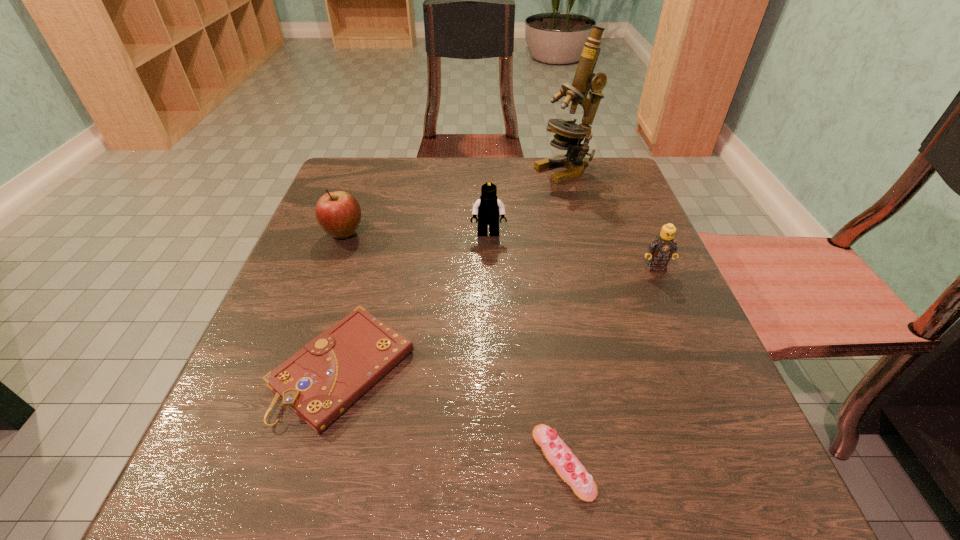
Where is `Lego located at the right edge`? Image resolution: width=960 pixels, height=540 pixels. Lego located at the right edge is located at coordinates (663, 247).

Where is `object that is at the far right corner`? This screenshot has height=540, width=960. object that is at the far right corner is located at coordinates (569, 135).

In order to click on vacant space at the far edge in this screenshot , I will do point(513,175).

Identify the location of vacant space at the left edge of the desktop. (343, 272).

This screenshot has width=960, height=540. In the image, there is a desktop. Identify the location of free space at the right edge. (623, 310).

You are a GUI agent. You are given a task and a screenshot of the screen. Output one action in this format:
    pyautogui.click(x=<x>, y=<y>)
    Task: Click on the vacant space at the far left corner of the desktop
    The image size is (960, 540).
    Given the screenshot: What is the action you would take?
    pyautogui.click(x=369, y=185)

This screenshot has height=540, width=960. I want to click on vacant space at the near left corner of the desktop, so click(178, 500).

The image size is (960, 540). In the image, there is a desktop. What are the coordinates of `free space at the far right corner` in the screenshot? It's located at (612, 185).

Locate an element on the screen. The height and width of the screenshot is (540, 960). vacant space at the near right corner of the desktop is located at coordinates (684, 467).

Find the location of a particular element. free space between the third object from left to right and the eclair is located at coordinates (526, 348).